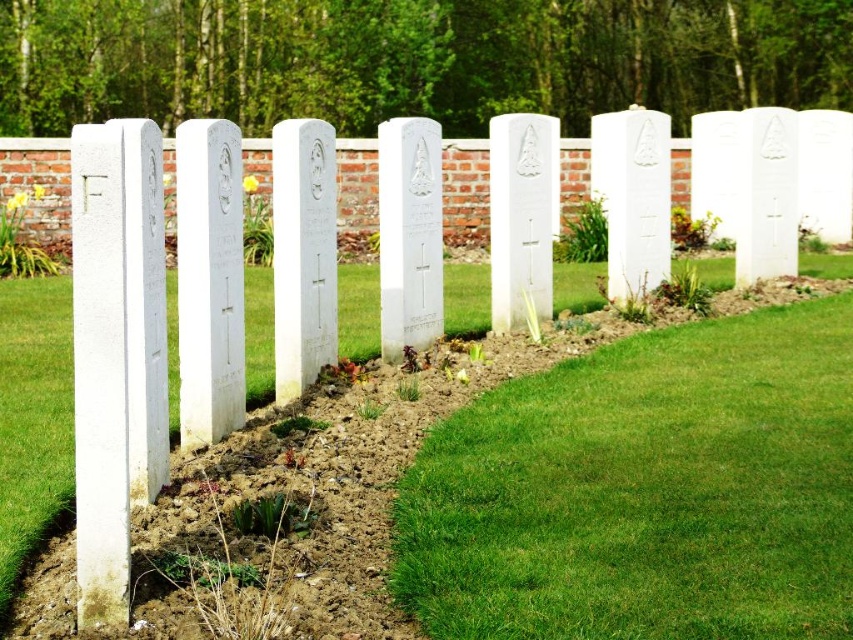
You are standing at the entrance of the cemetery and see two points marked in the image. The first point is at coordinate point (781, 438) and the second point is at coordinate point (498, 454). Which point is closer to the brick wall in the background?

Point (781, 438) is behind point (498, 454), so it is closer to the brick wall in the background.

You are a gardener planning to mow the lawn in the cemetery. You notice two patches of green grass at center and green grass at lower right. Which patch has a smaller width?

The green grass at center has a lesser width compared to green grass at lower right, so the green grass at center is the smaller one.

You are standing at the entrance of the cemetery and want to place a new headstone at the exact center of the green grass at center. According to the coordinates provided, where should you place the new headstone?

The new headstone should be placed at the coordinates point (646, 490) where the green grass at center is located.